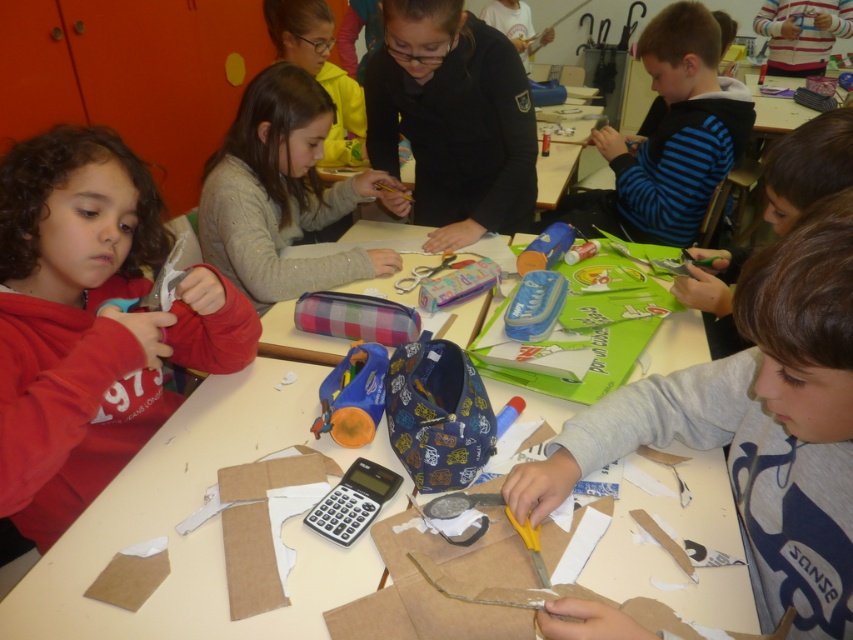
Is brown paper at center positioned behind dark blue fabric at upper right?

That is False.

What do you see at coordinates (201, 525) in the screenshot?
I see `brown paper at center` at bounding box center [201, 525].

Where is `brown paper at center`? Image resolution: width=853 pixels, height=640 pixels. brown paper at center is located at coordinates (201, 525).

Does matte red sweatshirt at left have a smaller size compared to blue striped sweater at upper right?

Yes.

Measure the distance between matte red sweatshirt at left and blue striped sweater at upper right.

A distance of 5.20 feet exists between matte red sweatshirt at left and blue striped sweater at upper right.

Find the location of a particular element. matte red sweatshirt at left is located at coordinates (90, 323).

Where is `matte red sweatshirt at left`? The width and height of the screenshot is (853, 640). matte red sweatshirt at left is located at coordinates (90, 323).

Does brown paper at center have a greater height compared to matte gray sweater at center?

No, brown paper at center is not taller than matte gray sweater at center.

Identify the location of brown paper at center. The height and width of the screenshot is (640, 853). (201, 525).